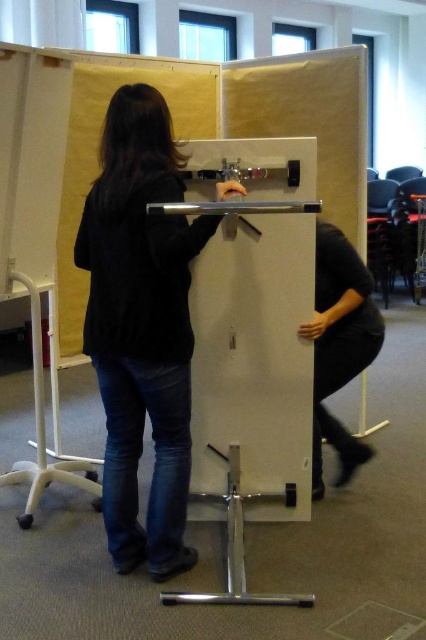
Does white matte easel at center have a lesser height compared to black matte shirt at right?

No.

Who is positioned more to the right, white matte easel at center or black matte shirt at right?

black matte shirt at right is more to the right.

Does point (298, 477) come farther from viewer compared to point (365, 454)?

No, (298, 477) is closer to viewer.

The height and width of the screenshot is (640, 426). Find the location of `white matte easel at center`. white matte easel at center is located at coordinates (252, 353).

Who is higher up, black matte sweater at center or black matte shirt at right?

black matte sweater at center is higher up.

The width and height of the screenshot is (426, 640). What do you see at coordinates (141, 326) in the screenshot?
I see `black matte sweater at center` at bounding box center [141, 326].

Locate an element on the screen. black matte sweater at center is located at coordinates (141, 326).

Does white matte easel at center have a greater height compared to black matte sweater at center?

No, white matte easel at center is not taller than black matte sweater at center.

Between white matte easel at center and black matte sweater at center, which one is positioned lower?

Positioned lower is white matte easel at center.

You are a GUI agent. You are given a task and a screenshot of the screen. Output one action in this format:
    pyautogui.click(x=<x>, y=<y>)
    Task: Click on the white matte easel at center
    The width and height of the screenshot is (426, 640).
    Given the screenshot: What is the action you would take?
    pyautogui.click(x=252, y=353)